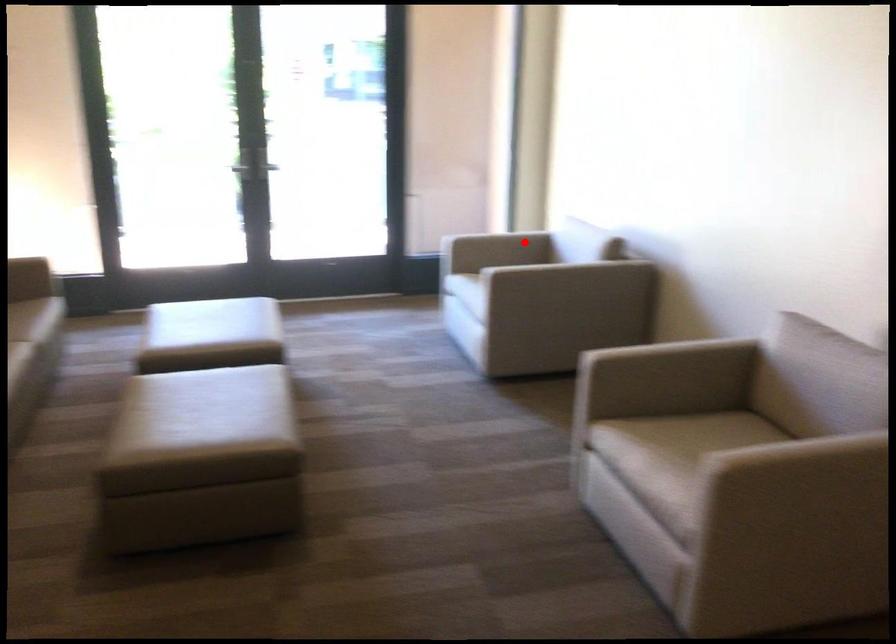
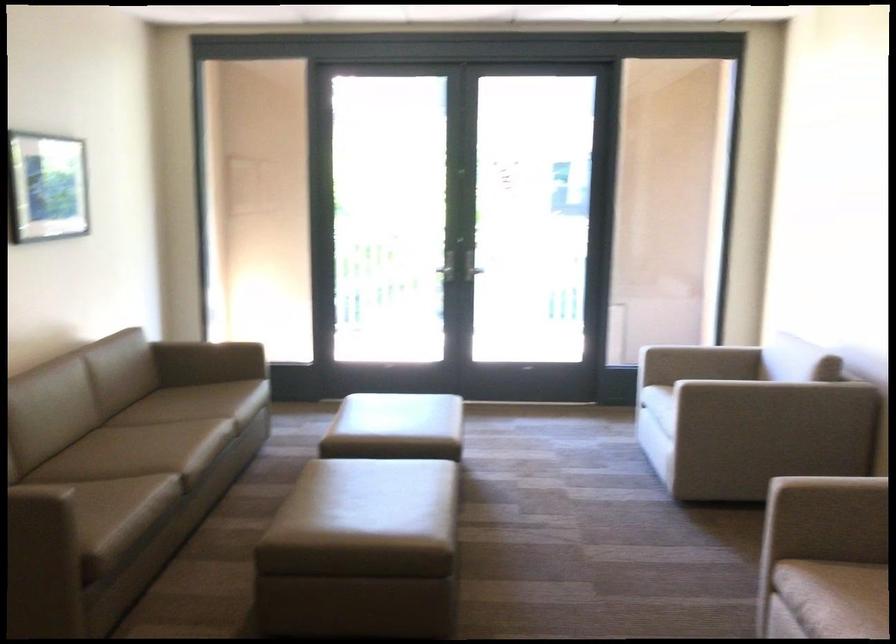
Where in the second image is the point corresponding to the highlighted location from the first image?

(734, 363)